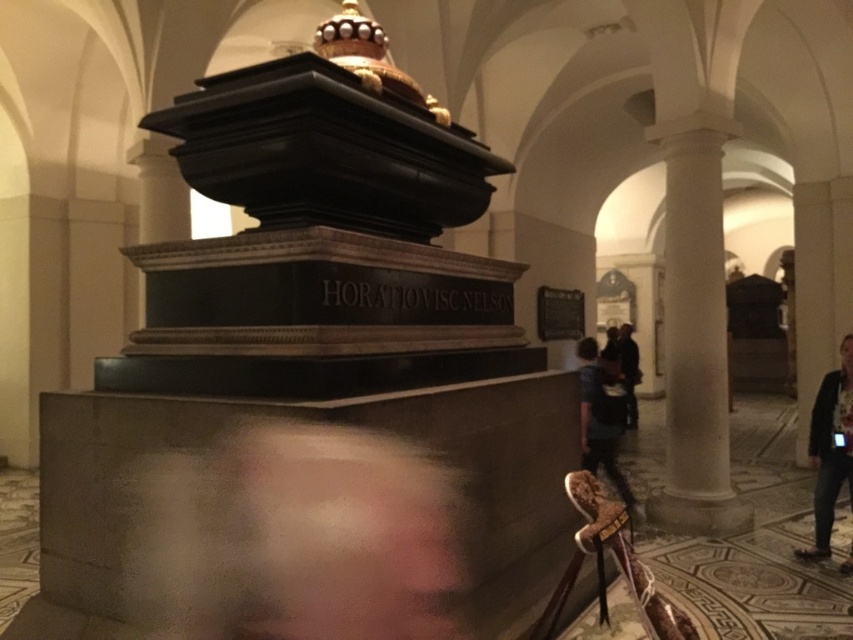
You are an interior designer observing the scene. You need to place a new decorative item between the jeans at lower right and the black leather jacket at right. Based on their positions, where should you position the item to ensure it is between them?

The jeans at lower right is located below the black leather jacket at right, so placing the decorative item between them would require positioning it in the middle area vertically between the jeans at lower right and the black leather jacket at right.